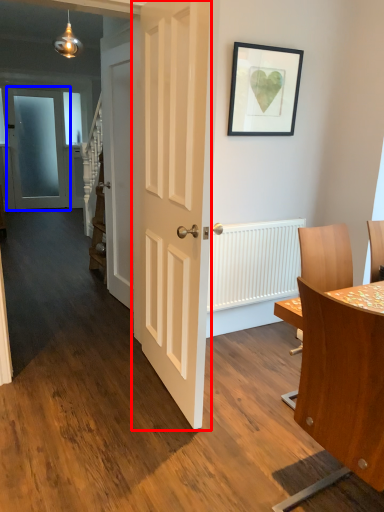
Question: Which point is further to the camera, door (highlighted by a red box) or door (highlighted by a blue box)?

Choices:
 (A) door
 (B) door

Answer: (B)